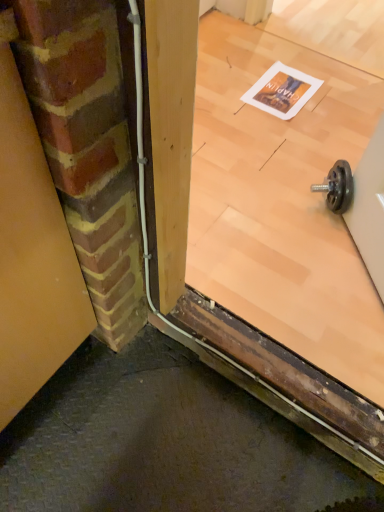
Identify the location of empty space that is ontop of transparent glass door at center (from a real-world perspective). The image size is (384, 512). coord(280,88).